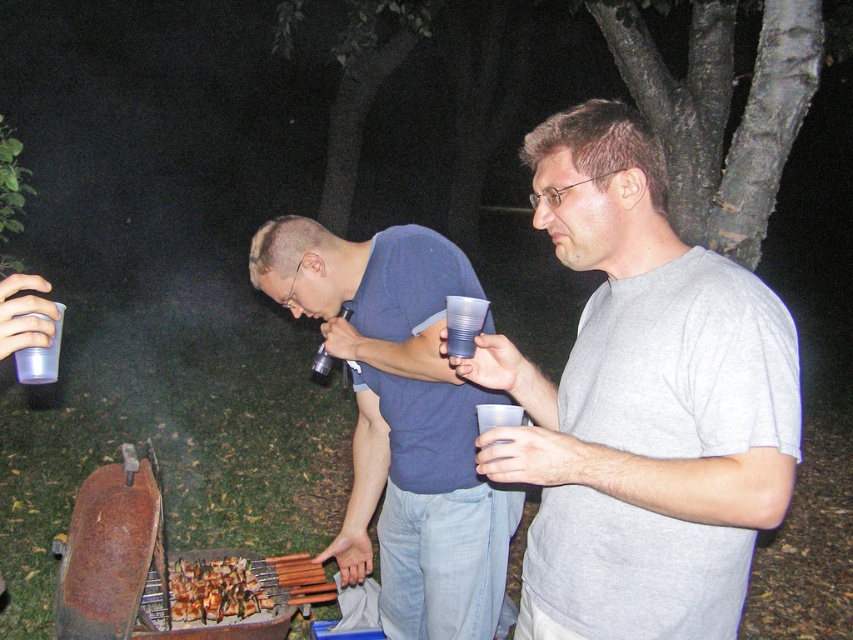
You are at a barbecue party and need to pour a drink into the larger transparent plastic cup. Which cup should you choose between the transparent plastic cup at center and the transparent plastic cup at lower left?

The transparent plastic cup at lower left is larger in width than the transparent plastic cup at center, so you should choose the transparent plastic cup at lower left.